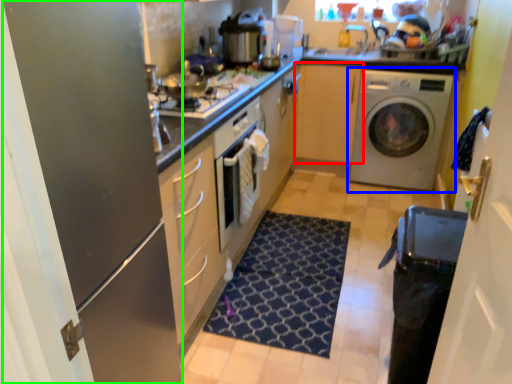
Question: Based on their relative distances, which object is farther from cabinetry (highlighted by a red box)? Choose from washing machine (highlighted by a blue box) and glass door (highlighted by a green box).

Choices:
 (A) washing machine
 (B) glass door

Answer: (B)